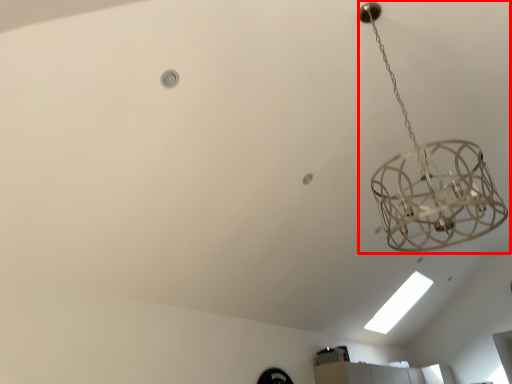
Question: Where is lamp (annotated by the red box) located in relation to light bulb in the image?

Choices:
 (A) left
 (B) right

Answer: (B)